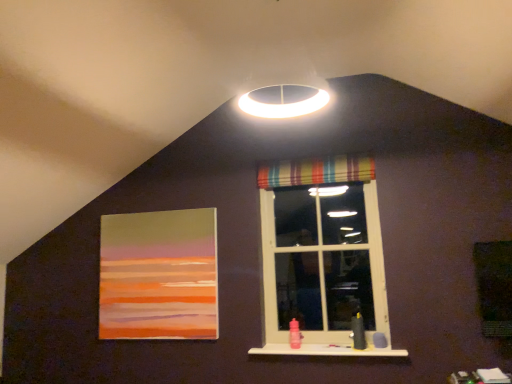
The height and width of the screenshot is (384, 512). In order to click on free spot above white matte window sill at lower center (from a real-world perspective) in this screenshot , I will do `click(328, 344)`.